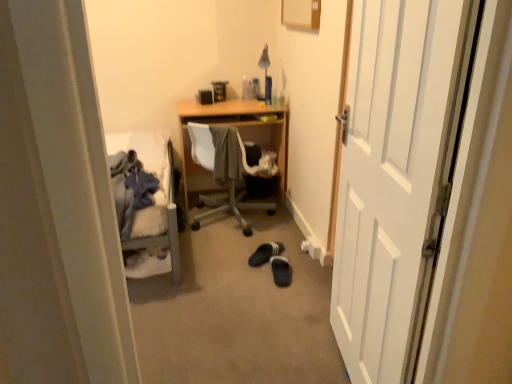
Question: From the image's perspective, does white wooden door at right appear higher than wooden chair at center?

Choices:
 (A) no
 (B) yes

Answer: (A)

Question: From a real-world perspective, does white wooden door at right sit lower than wooden chair at center?

Choices:
 (A) no
 (B) yes

Answer: (A)

Question: Is white wooden door at right beside wooden chair at center?

Choices:
 (A) no
 (B) yes

Answer: (A)

Question: Does white wooden door at right appear on the left side of wooden chair at center?

Choices:
 (A) no
 (B) yes

Answer: (A)

Question: Is white wooden door at right completely or partially outside of wooden chair at center?

Choices:
 (A) no
 (B) yes

Answer: (B)

Question: From a real-world perspective, is white wooden door at right positioned above or below black suede slippers at center, positioned as the second footwear in front-to-back order?

Choices:
 (A) below
 (B) above

Answer: (B)

Question: Considering their positions, is white wooden door at right located in front of or behind black suede slippers at center, positioned as the second footwear in front-to-back order?

Choices:
 (A) front
 (B) behind

Answer: (A)

Question: In terms of size, does white wooden door at right appear bigger or smaller than black suede slippers at center, positioned as the second footwear in front-to-back order?

Choices:
 (A) big
 (B) small

Answer: (A)

Question: From the image's perspective, relative to black suede slippers at center, positioned as the second footwear in front-to-back order, is white wooden door at right above or below?

Choices:
 (A) above
 (B) below

Answer: (A)

Question: In the image, is gray fabric at center, the 1th clothing viewed from the right, on the left side or the right side of denim jacket at left, marked as the 1th clothing in a left-to-right arrangement?

Choices:
 (A) left
 (B) right

Answer: (B)

Question: Considering the positions of gray fabric at center, the 1th clothing viewed from the right, and denim jacket at left, the second clothing when ordered from back to front, in the image, is gray fabric at center, the 1th clothing viewed from the right, wider or thinner than denim jacket at left, the second clothing when ordered from back to front,?

Choices:
 (A) wide
 (B) thin

Answer: (B)

Question: Is point (231, 175) closer or farther from the camera than point (141, 192)?

Choices:
 (A) farther
 (B) closer

Answer: (A)

Question: Considering their positions, is gray fabric at center, which ranks as the second clothing in left-to-right order, located in front of or behind denim jacket at left, marked as the 1th clothing in a front-to-back arrangement?

Choices:
 (A) behind
 (B) front

Answer: (A)

Question: Considering the positions of white wooden door at right and black suede slippers at center floor, arranged as the 1th footwear when viewed from the front, in the image, is white wooden door at right taller or shorter than black suede slippers at center floor, arranged as the 1th footwear when viewed from the front,?

Choices:
 (A) short
 (B) tall

Answer: (B)

Question: In terms of width, does white wooden door at right look wider or thinner when compared to black suede slippers at center floor, arranged as the 1th footwear when viewed from the front?

Choices:
 (A) wide
 (B) thin

Answer: (B)